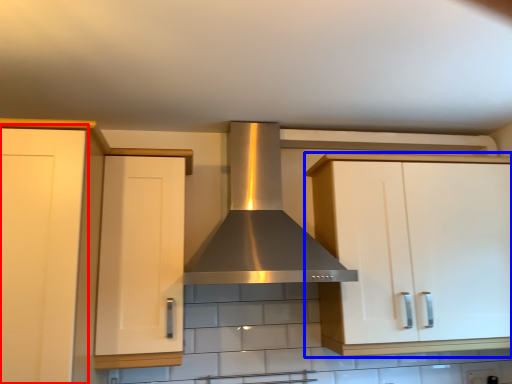
Question: Which object is closer to the camera taking this photo, cabinetry (highlighted by a red box) or cabinetry (highlighted by a blue box)?

Choices:
 (A) cabinetry
 (B) cabinetry

Answer: (A)